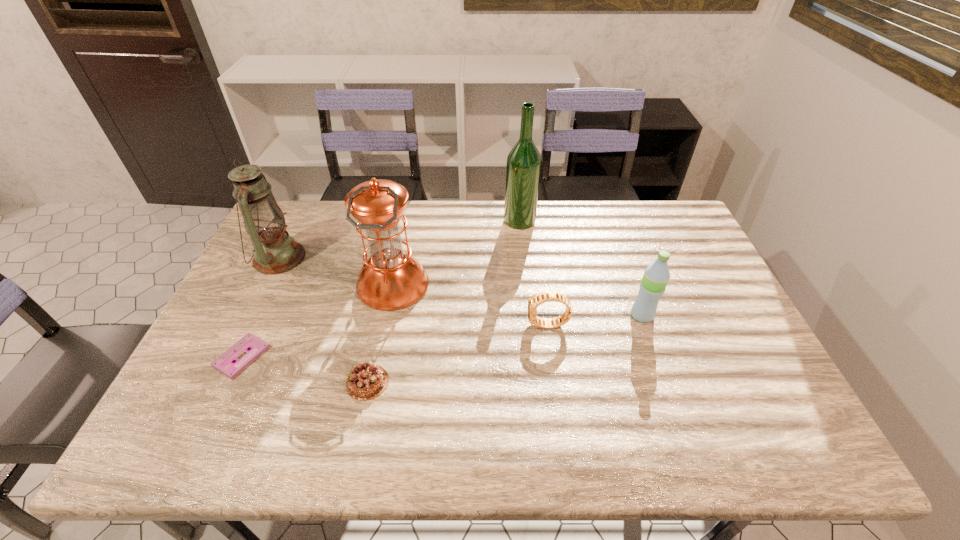
Locate an element on the screen. the farthest object is located at coordinates (523, 167).

Locate an element on the screen. This screenshot has height=540, width=960. the right oil lamp is located at coordinates (390, 279).

Locate an element on the screen. the left oil lamp is located at coordinates point(274,252).

This screenshot has width=960, height=540. In order to click on the rightmost object in this screenshot , I will do `click(656, 276)`.

I want to click on water bottle, so click(x=656, y=276).

Image resolution: width=960 pixels, height=540 pixels. In order to click on watch in this screenshot , I will do `click(534, 301)`.

You are a GUI agent. You are given a task and a screenshot of the screen. Output one action in this format:
    pyautogui.click(x=<x>, y=<y>)
    Task: Click on the sixth tallest object
    
    Given the screenshot: What is the action you would take?
    pyautogui.click(x=367, y=381)

Where is `the shortest object`? the shortest object is located at coordinates pyautogui.click(x=253, y=346).

Locate an element on the screen. The image size is (960, 540). free space located on the left of the alcohol is located at coordinates (421, 220).

What are the coordinates of `vacant space located 0.170m on the left of the right oil lamp` in the screenshot? It's located at (300, 285).